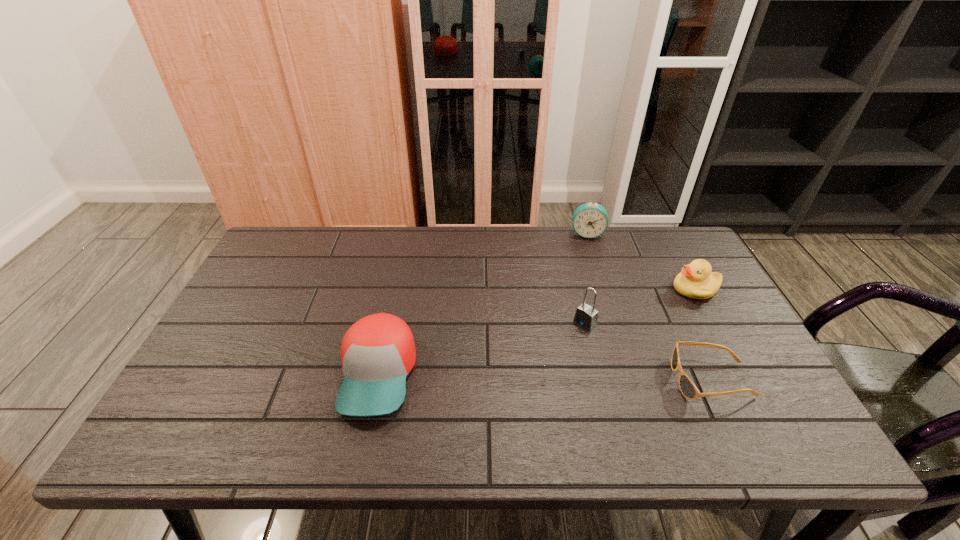
Identify the location of vacant position located 0.070m on the shackle of the padlock. (563, 342).

At what (x,y) coordinates should I click in order to perform the action: click on vacant space situated 0.230m on the front-facing side of the duckling. Please return your answer as a coordinate pair (x, y). The height and width of the screenshot is (540, 960). Looking at the image, I should click on (619, 325).

Identify the location of blank space located on the front-facing side of the duckling. (590, 339).

Find the location of a particular element. vacant space located on the front-facing side of the duckling is located at coordinates (569, 348).

I want to click on vacant point located on the front-facing side of the alarm clock, so pos(587,284).

The width and height of the screenshot is (960, 540). I want to click on vacant space situated 0.100m on the front-facing side of the alarm clock, so click(587, 259).

Where is `vacant region located on the front-facing side of the alarm clock`? The width and height of the screenshot is (960, 540). vacant region located on the front-facing side of the alarm clock is located at coordinates (588, 302).

The width and height of the screenshot is (960, 540). Find the location of `object that is at the far edge`. object that is at the far edge is located at coordinates (589, 220).

This screenshot has height=540, width=960. I want to click on baseball cap at the near edge, so click(x=378, y=352).

At what (x,y) coordinates should I click in order to perform the action: click on sunglasses at the near edge. Please return your answer as a coordinate pair (x, y). The image size is (960, 540). Looking at the image, I should click on pyautogui.click(x=688, y=389).